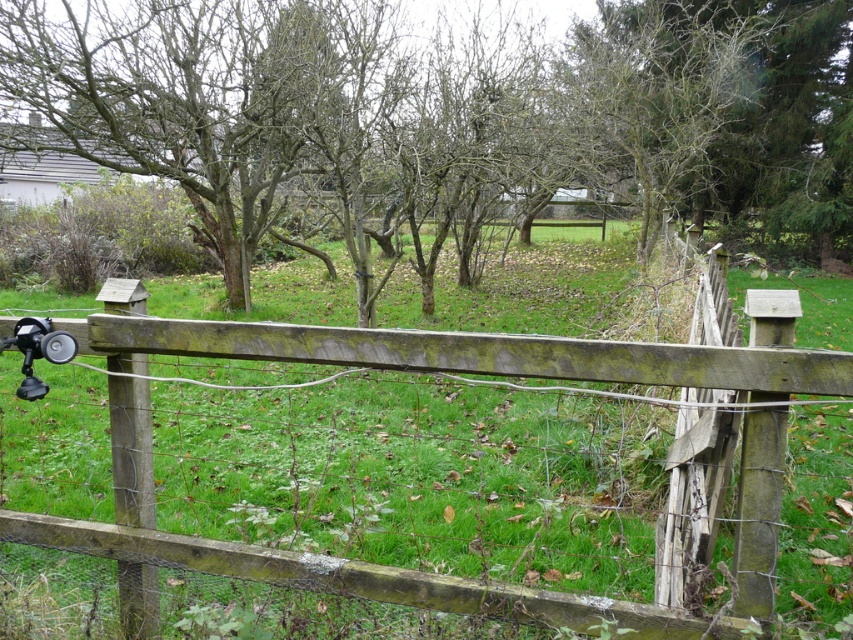
Between point (235, 161) and point (22, 392), which one is positioned behind?

The point (235, 161) is behind.

Where is `brown wood tree at center`? This screenshot has height=640, width=853. brown wood tree at center is located at coordinates [x=689, y=124].

Does weathered wood fence at center have a larger size compared to brown wood tree at center?

Incorrect, weathered wood fence at center is not larger than brown wood tree at center.

Is weathered wood fence at center thinner than brown wood tree at center?

Yes.

Which is behind, point (317, 403) or point (802, 138)?

Point (802, 138)

The height and width of the screenshot is (640, 853). I want to click on weathered wood fence at center, so click(407, 476).

Between weathered wood fence at center and matte black camera at lower left, which one has more height?

Standing taller between the two is weathered wood fence at center.

Is weathered wood fence at center bigger than matte black camera at lower left?

Correct, weathered wood fence at center is larger in size than matte black camera at lower left.

Is point (358, 493) in front of point (20, 339)?

No, (358, 493) is further to viewer.

Where is `weathered wood fence at center`? The height and width of the screenshot is (640, 853). weathered wood fence at center is located at coordinates (407, 476).